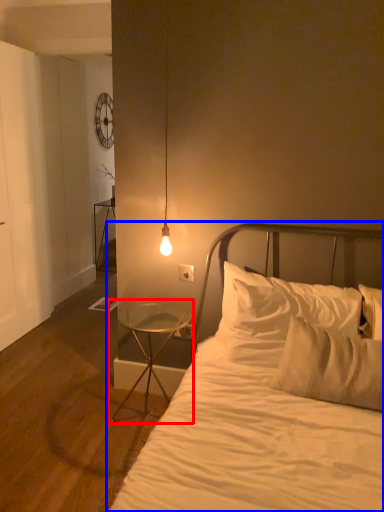
Question: Which object appears closest to the camera in this image, nightstand (highlighted by a red box) or bed (highlighted by a blue box)?

Choices:
 (A) nightstand
 (B) bed

Answer: (B)